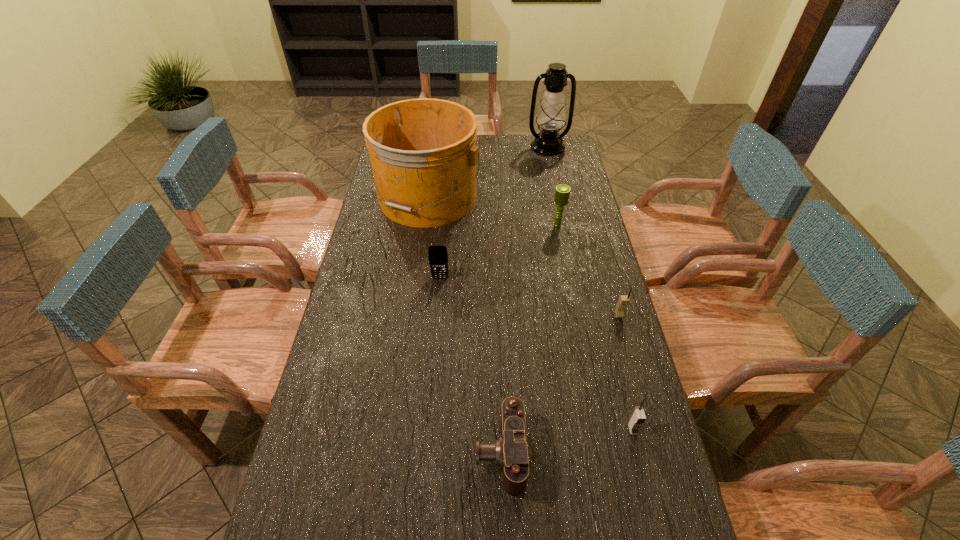
Identify the location of free spot between the sixth shortest object and the farthest object. (553, 186).

The image size is (960, 540). Identify the location of free space between the second tallest object and the oil lamp. (487, 172).

The height and width of the screenshot is (540, 960). Find the location of `free point between the rightmost cellular telephone and the sixth shortest object`. free point between the rightmost cellular telephone and the sixth shortest object is located at coordinates (588, 270).

Identify the location of empty space that is in between the second tallest object and the oil lamp. The height and width of the screenshot is (540, 960). (487, 172).

The width and height of the screenshot is (960, 540). I want to click on vacant area that lies between the fifth farthest object and the third tallest object, so click(588, 270).

Find the location of `object that is the fourth closest one to the farthest object`. object that is the fourth closest one to the farthest object is located at coordinates (623, 300).

Locate which object ranks third in proximity to the farthest object. Please provide its 2D coordinates. Your answer should be formatted as a tuple, i.e. [(x, y)], where the tuple contains the x and y coordinates of a point satisfying the conditions above.

[(438, 257)]

Select which cellular telephone is the closest to the farthest cellular telephone. Please provide its 2D coordinates. Your answer should be formatted as a tuple, i.e. [(x, y)], where the tuple contains the x and y coordinates of a point satisfying the conditions above.

[(623, 300)]

Where is `the third closest cellular telephone to the farthest object`? Image resolution: width=960 pixels, height=540 pixels. the third closest cellular telephone to the farthest object is located at coordinates (637, 418).